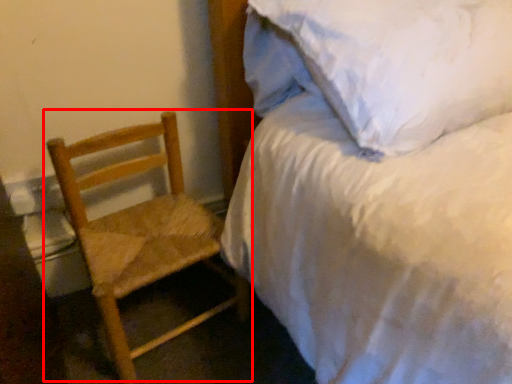
Question: From the image's perspective, what is the correct spatial positioning of chair (annotated by the red box) in reference to bed?

Choices:
 (A) above
 (B) below

Answer: (B)